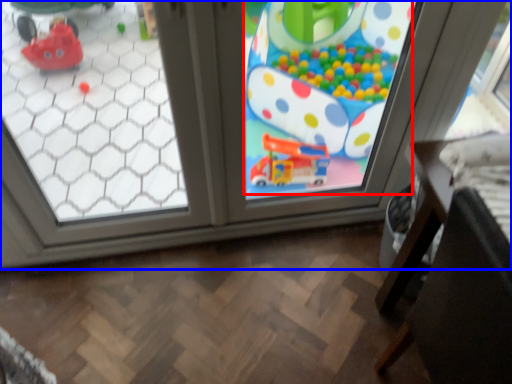
Question: Which point is further to the camera, toy (highlighted by a red box) or window (highlighted by a blue box)?

Choices:
 (A) toy
 (B) window

Answer: (A)